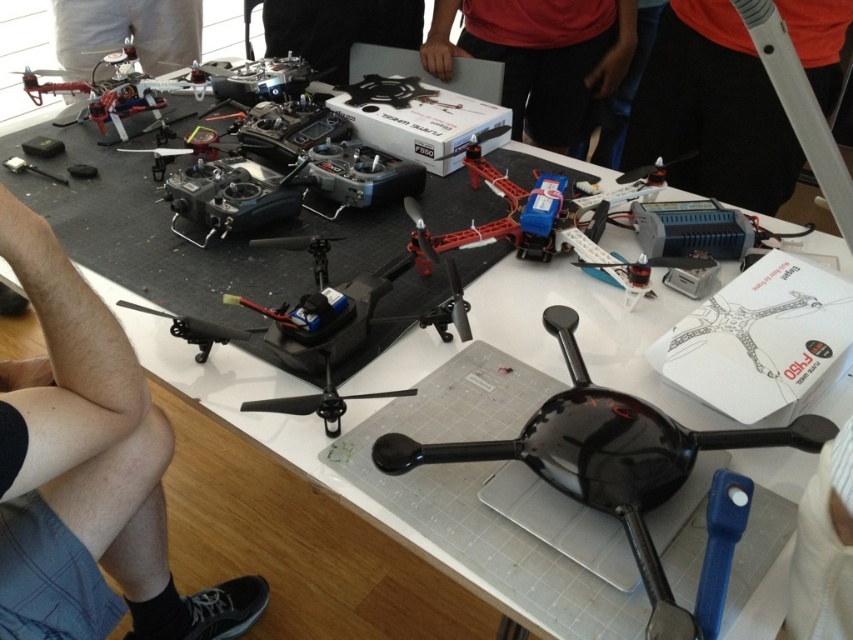
Which is more to the right, orange fabric shirt at upper right or black plastic propeller at center?

orange fabric shirt at upper right is more to the right.

Between point (834, 52) and point (326, 432), which one is positioned behind?

The point (834, 52) is behind.

Does point (677, 186) come in front of point (270, 408)?

No, (677, 186) is behind (270, 408).

I want to click on orange fabric shirt at upper right, so click(712, 109).

Which is below, red matte box at center or black plastic propeller at center?

black plastic propeller at center

Is red matte box at center positioned at the back of black plastic propeller at center?

Yes, it is behind black plastic propeller at center.

The image size is (853, 640). Identify the location of red matte box at center. pyautogui.click(x=540, y=56).

Can you confirm if orange fabric shirt at upper right is wider than metallic silver drone at upper left?

Indeed, orange fabric shirt at upper right has a greater width compared to metallic silver drone at upper left.

Identify the location of orange fabric shirt at upper right. (712, 109).